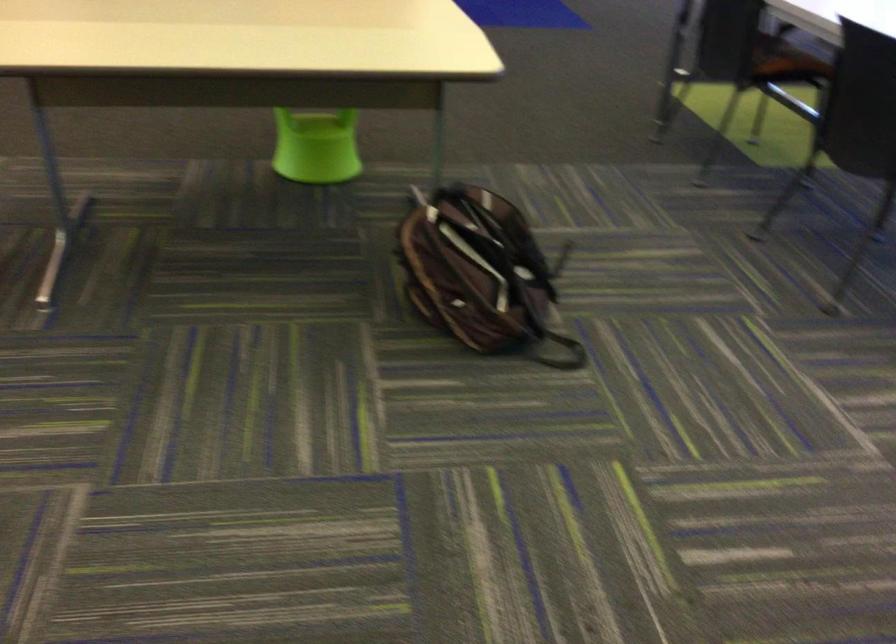
Locate an element on the screen. The width and height of the screenshot is (896, 644). green chair sitting surface is located at coordinates (322, 67).